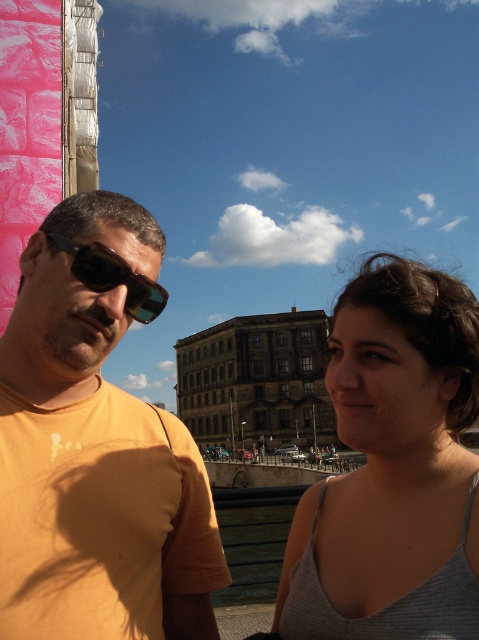
Question: Can you confirm if matte orange t-shirt at center is smaller than gray fabric tank top at center?

Choices:
 (A) no
 (B) yes

Answer: (A)

Question: Which is farther from the black reflective sunglasses at left?

Choices:
 (A) gray fabric tank top at center
 (B) matte orange t-shirt at left
 (C) matte orange t-shirt at center

Answer: (A)

Question: Which of the following is the closest to the observer?

Choices:
 (A) (77, 259)
 (B) (139, 566)
 (C) (469, 614)
 (D) (45, 470)

Answer: (C)

Question: Which object is the farthest from the black reflective sunglasses at left?

Choices:
 (A) matte orange t-shirt at center
 (B) gray fabric tank top at center
 (C) matte orange t-shirt at left

Answer: (B)

Question: Is gray fabric tank top at center below black reflective sunglasses at left?

Choices:
 (A) no
 (B) yes

Answer: (B)

Question: Is matte orange t-shirt at center thinner than gray fabric tank top at center?

Choices:
 (A) no
 (B) yes

Answer: (A)